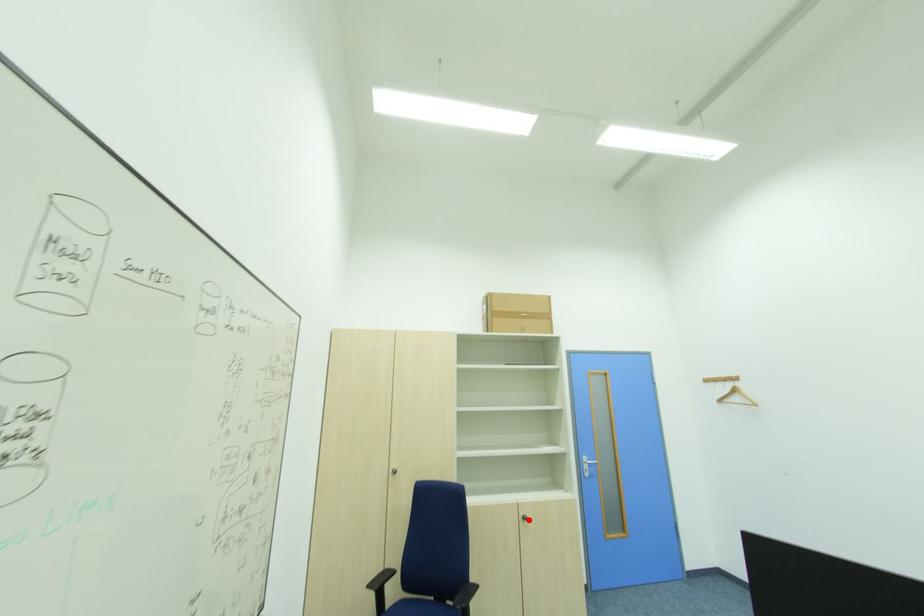
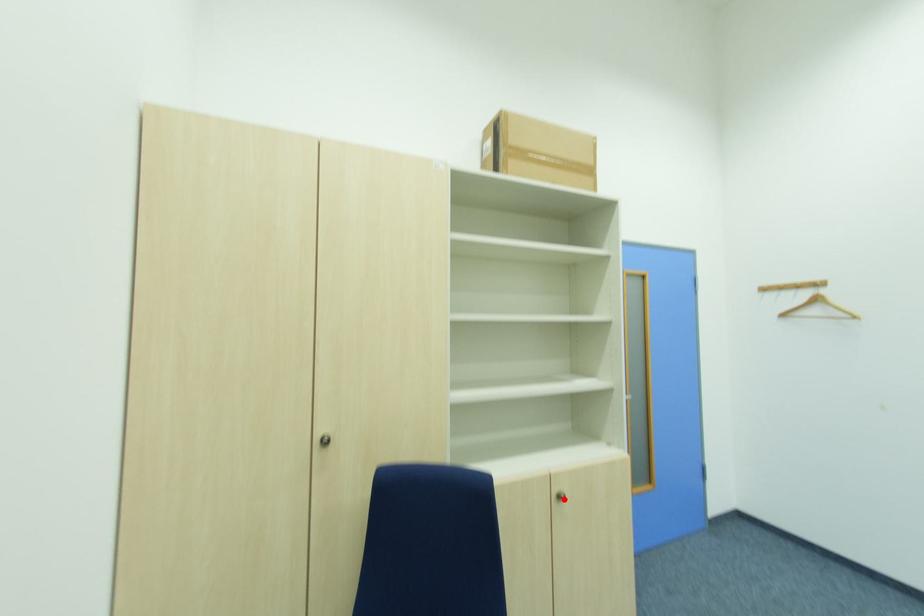
I am providing you with two images of the same scene from different viewpoints. A red point is marked on the first image and another point is marked on the second image. Is the marked point in image1 the same physical position as the marked point in image2?

Yes